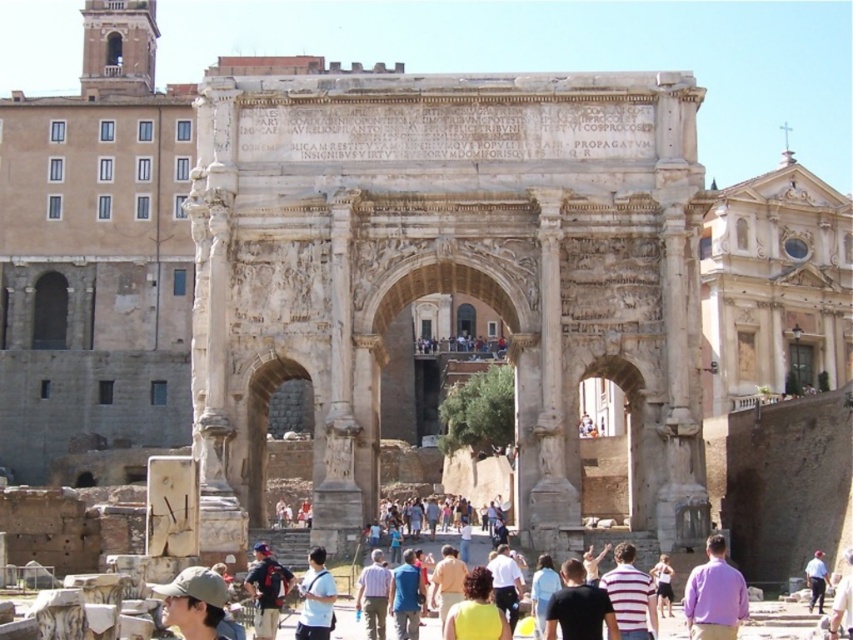
Which of these two, purple cotton shirt at center or white matte shirt at center, stands taller?

Standing taller between the two is purple cotton shirt at center.

Consider the image. Who is higher up, purple cotton shirt at center or white matte shirt at center?

Positioned higher is purple cotton shirt at center.

Who is more forward, (683, 612) or (294, 632)?

Point (683, 612) is in front.

Identify the location of purple cotton shirt at center. This screenshot has height=640, width=853. (714, 595).

Does khaki fabric cap at lower left have a lesser height compared to light blue shirt at center?

No.

Is khaki fabric cap at lower left to the left of light blue shirt at center from the viewer's perspective?

Indeed, khaki fabric cap at lower left is positioned on the left side of light blue shirt at center.

Does point (187, 627) come behind point (817, 582)?

No.

I want to click on khaki fabric cap at lower left, so click(194, 604).

Where is `black t-shirt at center`? black t-shirt at center is located at coordinates (579, 608).

Which is more to the left, black t-shirt at center or striped shirt at center?

striped shirt at center

Does point (558, 600) come behind point (358, 589)?

That is False.

Find the location of a particular element. black t-shirt at center is located at coordinates (579, 608).